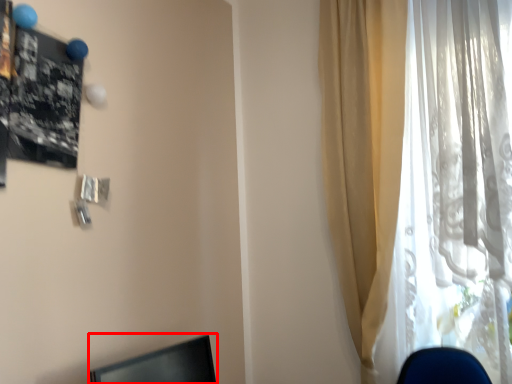
Question: From the image's perspective, considering the relative positions of desktop (annotated by the red box) and curtain in the image provided, where is desktop (annotated by the red box) located with respect to the staircase?

Choices:
 (A) below
 (B) above

Answer: (A)